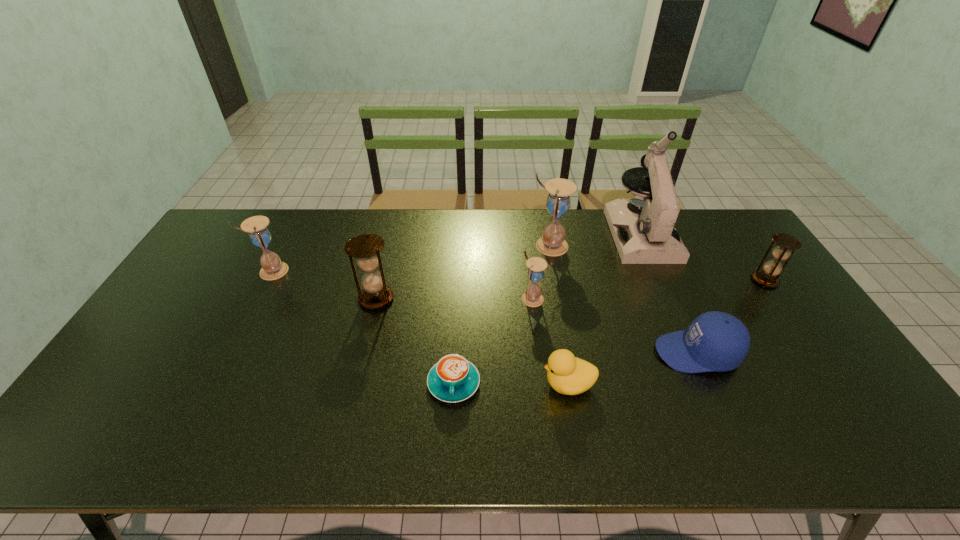
Identify the location of blue cap. (715, 341).

Where is `duck`? duck is located at coordinates (567, 374).

The height and width of the screenshot is (540, 960). Find the location of `the shortest object`. the shortest object is located at coordinates (453, 379).

I want to click on turquoise cappuccino, so click(x=453, y=379).

At what (x,y) coordinates should I click in order to perform the action: click on vacant area located at the eyepiece of the tallest object. Please return your answer as a coordinate pair (x, y). This screenshot has width=960, height=540. Looking at the image, I should click on (663, 285).

Identify the location of free space located 0.070m on the right of the farthest hourglass. The image size is (960, 540). 588,246.

The width and height of the screenshot is (960, 540). I want to click on free space located on the left of the left brown hourglass, so click(273, 299).

This screenshot has width=960, height=540. I want to click on free region located on the left of the leftmost object, so click(x=228, y=271).

Identify the location of vacant space located on the right of the nearest white hourglass. The width and height of the screenshot is (960, 540). (662, 299).

Find the location of a particular element. The width and height of the screenshot is (960, 540). free space located on the left of the rightmost object is located at coordinates (736, 280).